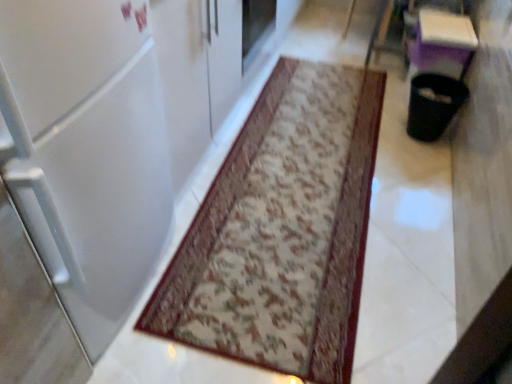
Question: Would you say white glossy refrigerator at center is to the left or to the right of floral carpet at center in the picture?

Choices:
 (A) right
 (B) left

Answer: (B)

Question: Is white glossy refrigerator at center spatially inside floral carpet at center, or outside of it?

Choices:
 (A) inside
 (B) outside

Answer: (B)

Question: From a real-world perspective, is white glossy refrigerator at center physically located above or below floral carpet at center?

Choices:
 (A) above
 (B) below

Answer: (A)

Question: In terms of size, does floral carpet at center appear bigger or smaller than white glossy refrigerator at center?

Choices:
 (A) small
 (B) big

Answer: (A)

Question: Considering the positions of floral carpet at center and white glossy refrigerator at center in the image, is floral carpet at center wider or thinner than white glossy refrigerator at center?

Choices:
 (A) wide
 (B) thin

Answer: (A)

Question: Which is correct: floral carpet at center is inside white glossy refrigerator at center, or outside of it?

Choices:
 (A) inside
 (B) outside

Answer: (B)

Question: From the image's perspective, is floral carpet at center located above or below white glossy refrigerator at center?

Choices:
 (A) above
 (B) below

Answer: (B)